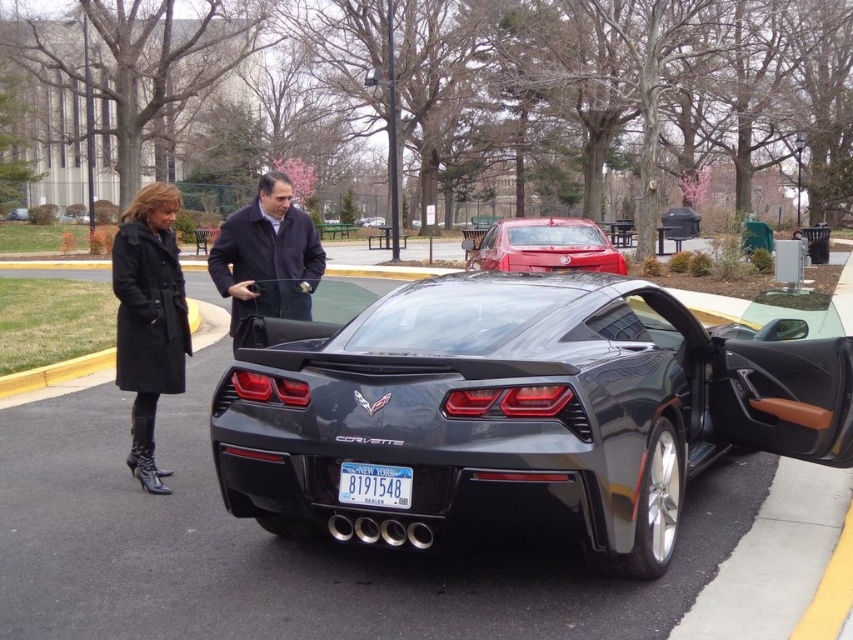
Where is `black wool coat at left`? The width and height of the screenshot is (853, 640). black wool coat at left is located at coordinates (149, 320).

Between black wool coat at left and shiny red sedan at center, which one is positioned lower?

Positioned lower is black wool coat at left.

Between point (138, 275) and point (527, 248), which one is positioned in front?

Point (138, 275)

I want to click on black wool coat at left, so click(x=149, y=320).

In the scene shown: Which is below, shiny black car at center or blue metallic license plate at center?

blue metallic license plate at center is below.

Is shiny black car at center bigger than blue metallic license plate at center?

Yes.

This screenshot has width=853, height=640. Describe the element at coordinates (518, 412) in the screenshot. I see `shiny black car at center` at that location.

The height and width of the screenshot is (640, 853). Find the location of `shiny black car at center`. shiny black car at center is located at coordinates (518, 412).

Is blue metallic license plate at center bigger than satin black sports car at center?

No, blue metallic license plate at center is not bigger than satin black sports car at center.

Does blue metallic license plate at center appear on the right side of satin black sports car at center?

Indeed, blue metallic license plate at center is positioned on the right side of satin black sports car at center.

Does point (392, 483) lie in front of point (381, 221)?

Yes, it is.

Locate an element on the screen. This screenshot has width=853, height=640. blue metallic license plate at center is located at coordinates (374, 484).